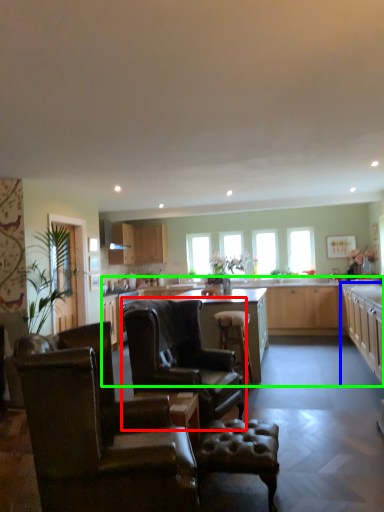
Question: Based on their relative distances, which object is nearer to chair (highlighted by a red box)? Choose from cabinetry (highlighted by a blue box) and countertop (highlighted by a green box).

Choices:
 (A) cabinetry
 (B) countertop

Answer: (A)